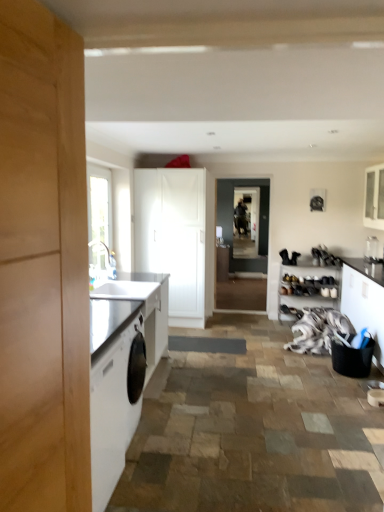
Question: Considering the relative sizes of white fabric at lower right and clear glass window at left in the image provided, is white fabric at lower right bigger than clear glass window at left?

Choices:
 (A) yes
 (B) no

Answer: (A)

Question: Is white fabric at lower right far from clear glass window at left?

Choices:
 (A) no
 (B) yes

Answer: (B)

Question: From the image's perspective, would you say white fabric at lower right is positioned over clear glass window at left?

Choices:
 (A) yes
 (B) no

Answer: (B)

Question: Can you confirm if white fabric at lower right is wider than clear glass window at left?

Choices:
 (A) yes
 (B) no

Answer: (A)

Question: Does white fabric at lower right have a lesser height compared to clear glass window at left?

Choices:
 (A) yes
 (B) no

Answer: (A)

Question: Does white fabric at lower right come in front of clear glass window at left?

Choices:
 (A) yes
 (B) no

Answer: (B)

Question: Can you confirm if dark gray matte screen door at center, marked as the first screen door in a front-to-back arrangement, is smaller than clear glass vase at upper right?

Choices:
 (A) no
 (B) yes

Answer: (A)

Question: Is dark gray matte screen door at center, positioned as the second screen door in back-to-front order, positioned beyond the bounds of clear glass vase at upper right?

Choices:
 (A) yes
 (B) no

Answer: (A)

Question: Is dark gray matte screen door at center, positioned as the second screen door in back-to-front order, facing towards clear glass vase at upper right?

Choices:
 (A) no
 (B) yes

Answer: (A)

Question: Considering the relative sizes of dark gray matte screen door at center, positioned as the second screen door in back-to-front order, and clear glass vase at upper right in the image provided, is dark gray matte screen door at center, positioned as the second screen door in back-to-front order, taller than clear glass vase at upper right?

Choices:
 (A) no
 (B) yes

Answer: (B)

Question: Does dark gray matte screen door at center, the second screen door positioned from the right, have a lesser height compared to clear glass vase at upper right?

Choices:
 (A) no
 (B) yes

Answer: (A)

Question: Is dark gray matte screen door at center, positioned as the second screen door in back-to-front order, positioned behind clear glass vase at upper right?

Choices:
 (A) yes
 (B) no

Answer: (A)

Question: Considering the relative sizes of dark gray matte screen door at center, the 1th screen door when ordered from left to right, and white glossy cabinet at upper right, which is the fourth cabinetry from left to right, in the image provided, is dark gray matte screen door at center, the 1th screen door when ordered from left to right, shorter than white glossy cabinet at upper right, which is the fourth cabinetry from left to right,?

Choices:
 (A) no
 (B) yes

Answer: (A)